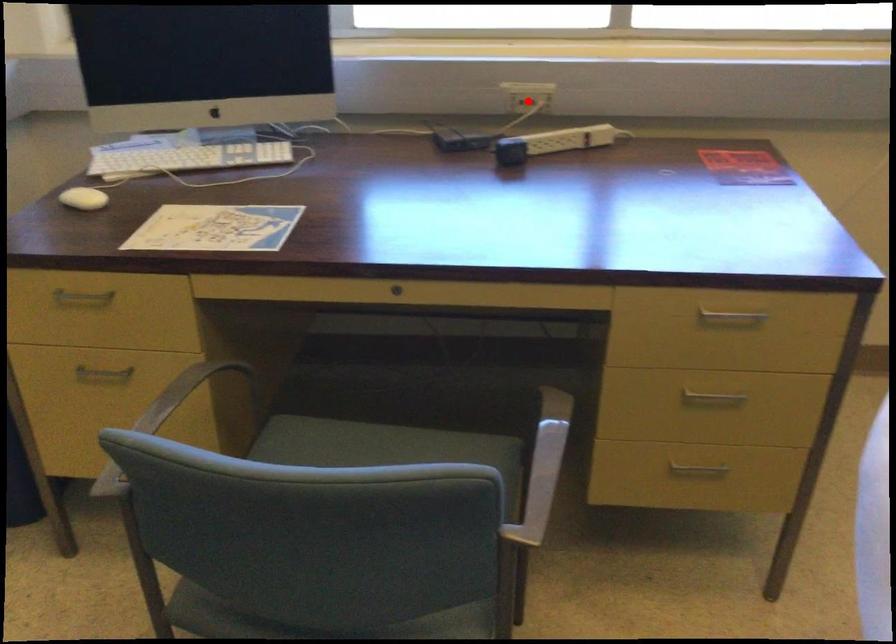
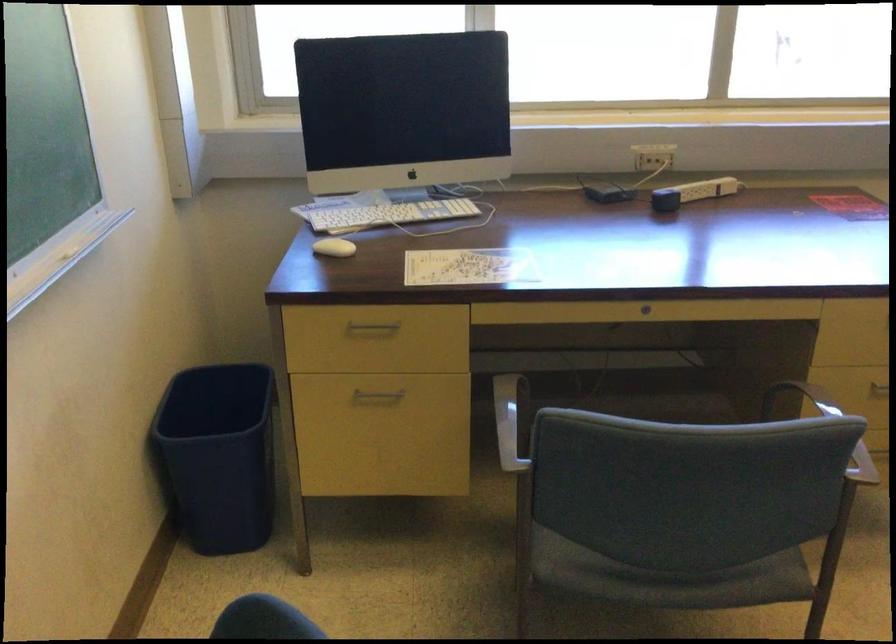
Question: I am providing you with two images of the same scene from different viewpoints. Image1 has a red point marked. In image2, the corresponding 3D location appears at what relative position? Reply with the corresponding letter.

Choices:
 (A) Closer
 (B) Farther

Answer: (B)